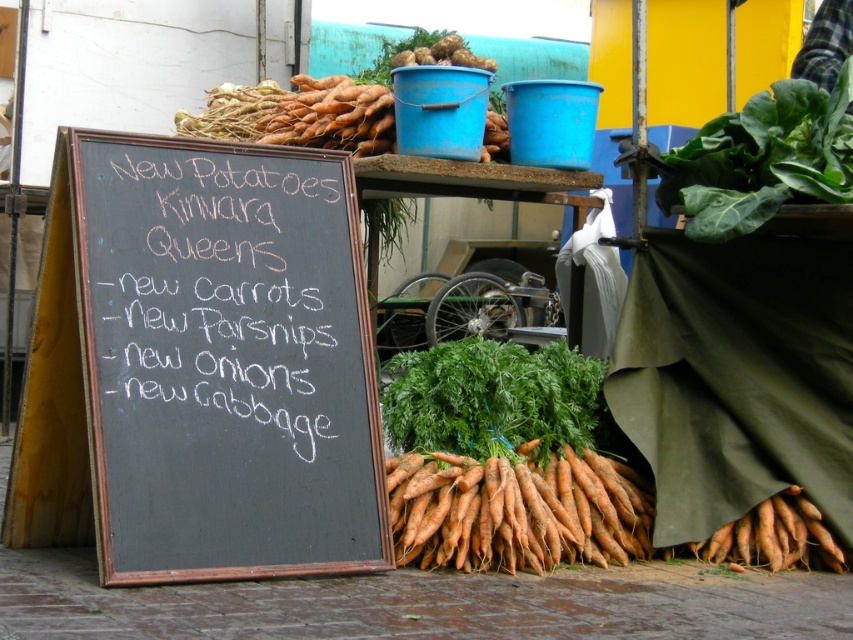
You are a customer at this market and want to buy carrots. You see two groups of carrots labeled as orange matte carrots at center and orange matte carrots at upper center. Which group is to the right of the other?

The orange matte carrots at center is positioned on the right side of orange matte carrots at upper center, so the carrots at center are to the right of the carrots at upper center.